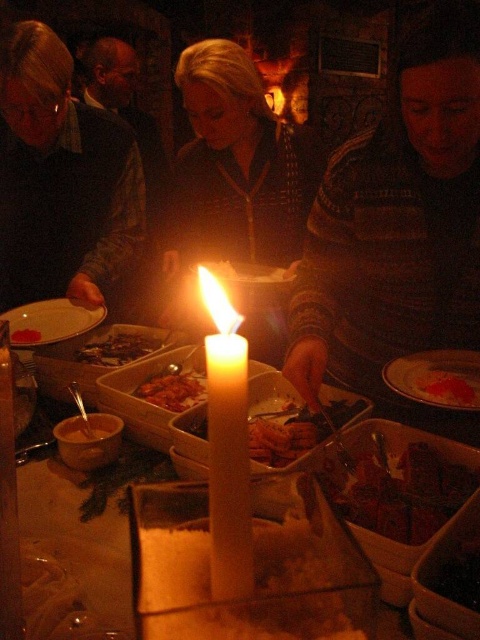
You are at a party and want to take a photo of the striped sweater at center and the blonde hair at center. Which object should you focus on first if you want to capture both in the same frame without moving the camera?

The striped sweater at center is shorter than the blonde hair at center, so you should focus on the blonde hair at center first to ensure both are in focus.

You are a guest at a party and want to grab both the smooth chocolate bar at center and the shiny red sauce at center from the buffet table. If your hand can reach 20 inches in one stretch, can you pick both items without moving your hand position?

The smooth chocolate bar at center is 19.70 inches away from the shiny red sauce at center. Since your hand can reach 20 inches, you can easily grab both items in one stretch without needing to adjust your hand position.

You are a guest at a party and see the smooth chocolate bar at center and the shiny red sauce at center on the buffet table. Which item is positioned lower on the table?

The smooth chocolate bar at center is positioned lower than the shiny red sauce at center on the table.